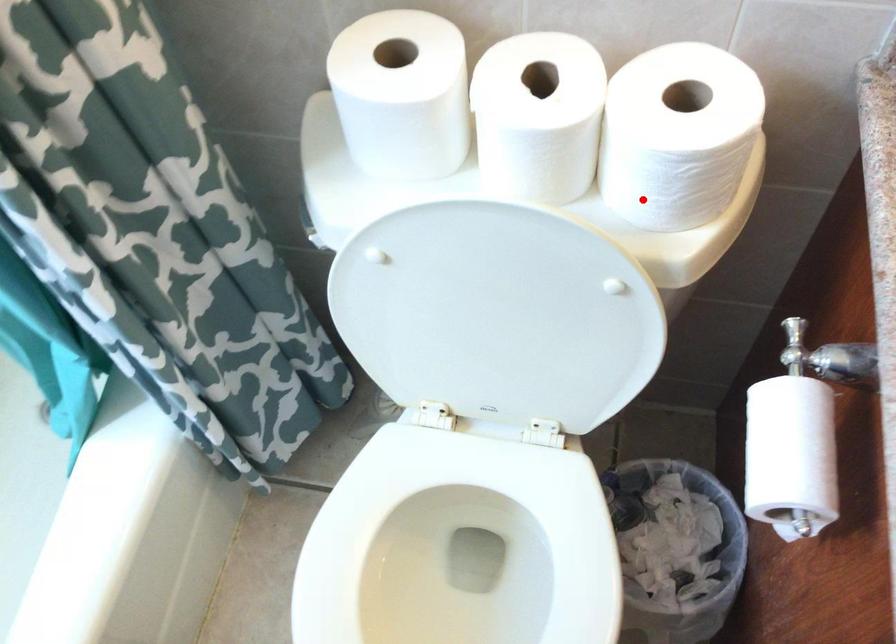
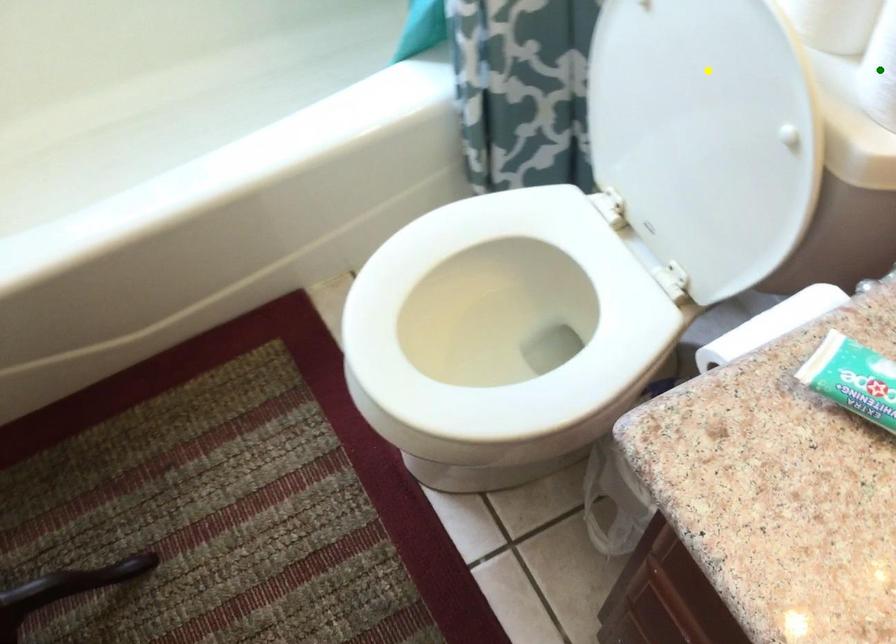
Question: I am providing you with two images of the same scene from different viewpoints. A red point is marked on the first image. You are given multiple points on the second image. Which point in image 2 is actually the same real-world point as the red point in image 1?

Choices:
 (A) yellow point
 (B) blue point
 (C) green point

Answer: (B)